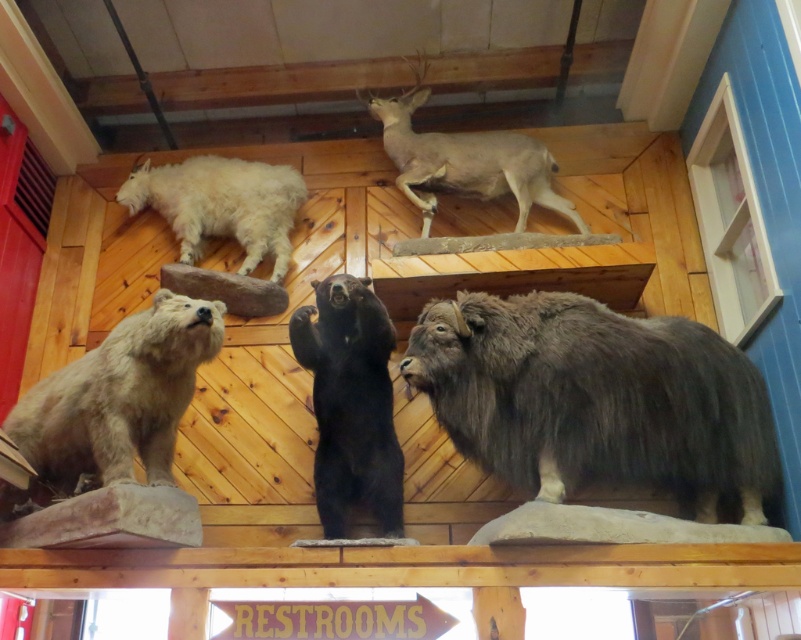
Is point (542, 422) less distant than point (170, 177)?

Yes, it is.

Who is positioned more to the right, brown fuzzy yak at lower right or white fluffy goat at upper left?

From the viewer's perspective, brown fuzzy yak at lower right appears more on the right side.

This screenshot has width=801, height=640. I want to click on brown fuzzy yak at lower right, so click(596, 397).

From the picture: Can you confirm if light brown fur bear at lower left is thinner than light brown fur deer at upper center?

Correct, light brown fur bear at lower left's width is less than light brown fur deer at upper center's.

Can you confirm if light brown fur bear at lower left is wider than light brown fur deer at upper center?

No, light brown fur bear at lower left is not wider than light brown fur deer at upper center.

Who is more distant from viewer, (x=172, y=300) or (x=477, y=180)?

Point (x=477, y=180)

At what (x,y) coordinates should I click in order to perform the action: click on light brown fur bear at lower left. Please return your answer as a coordinate pair (x, y). The height and width of the screenshot is (640, 801). Looking at the image, I should click on (115, 403).

How far apart are brown fuzzy yak at lower right and light brown fur deer at upper center?

They are 37.31 inches apart.

Does brown fuzzy yak at lower right have a smaller size compared to light brown fur deer at upper center?

No.

Where is `brown fuzzy yak at lower right`? This screenshot has width=801, height=640. brown fuzzy yak at lower right is located at coordinates (596, 397).